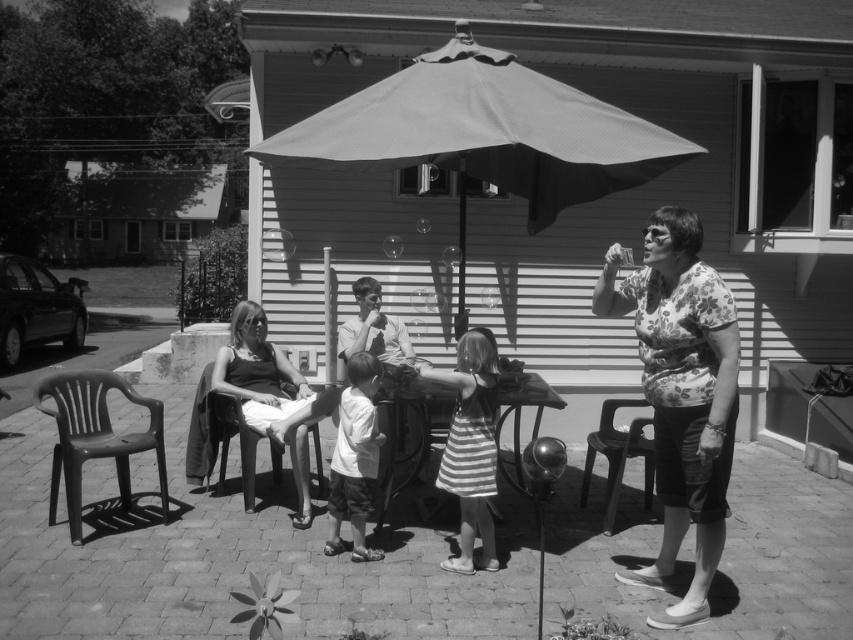
Question: Is plastic chair at right thinner than smooth fabric shirt at center?

Choices:
 (A) no
 (B) yes

Answer: (B)

Question: Among these points, which one is nearest to the camera?

Choices:
 (A) (608, 484)
 (B) (485, 516)
 (C) (341, 483)

Answer: (B)

Question: From the image, what is the correct spatial relationship of black plastic chair at lower left in relation to plastic chair at right?

Choices:
 (A) above
 (B) below

Answer: (A)

Question: Which object appears farthest from the camera in this image?

Choices:
 (A) textured fabric umbrella at center
 (B) floral shirt at center

Answer: (A)

Question: Can you confirm if striped fabric dress at center is wider than plastic chair at right?

Choices:
 (A) no
 (B) yes

Answer: (A)

Question: Which of the following is the farthest from the observer?

Choices:
 (A) (474, 484)
 (B) (589, 132)
 (C) (619, 294)

Answer: (B)